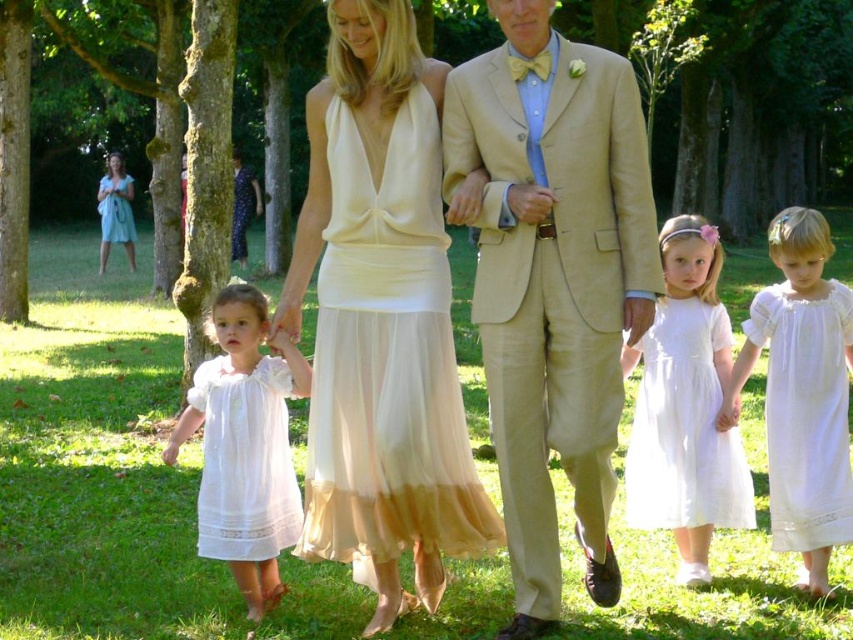
Between point (561, 413) and point (675, 388), which one is positioned behind?

Positioned behind is point (675, 388).

Does beige linen suit at center appear over white lace dress at center?

Yes.

This screenshot has width=853, height=640. Describe the element at coordinates (554, 282) in the screenshot. I see `beige linen suit at center` at that location.

Where is `beige linen suit at center`? beige linen suit at center is located at coordinates (554, 282).

Can you confirm if white lace dress at left is positioned below white lace dress at lower left?

Incorrect, white lace dress at left is not positioned below white lace dress at lower left.

Is point (199, 397) less distant than point (294, 483)?

Yes, point (199, 397) is in front of point (294, 483).

At what (x,y) coordinates should I click in order to perform the action: click on white lace dress at left. Please return your answer as a coordinate pair (x, y). Image resolution: width=853 pixels, height=640 pixels. Looking at the image, I should click on (245, 445).

Does beige linen suit at center appear on the left side of matte blue dress at upper left?

No, beige linen suit at center is not to the left of matte blue dress at upper left.

Looking at this image, is the position of beige linen suit at center more distant than that of matte blue dress at upper left?

That is False.

Between point (506, 241) and point (126, 182), which one is positioned behind?

Positioned behind is point (126, 182).

Find the location of a particular element. The height and width of the screenshot is (640, 853). beige linen suit at center is located at coordinates (554, 282).